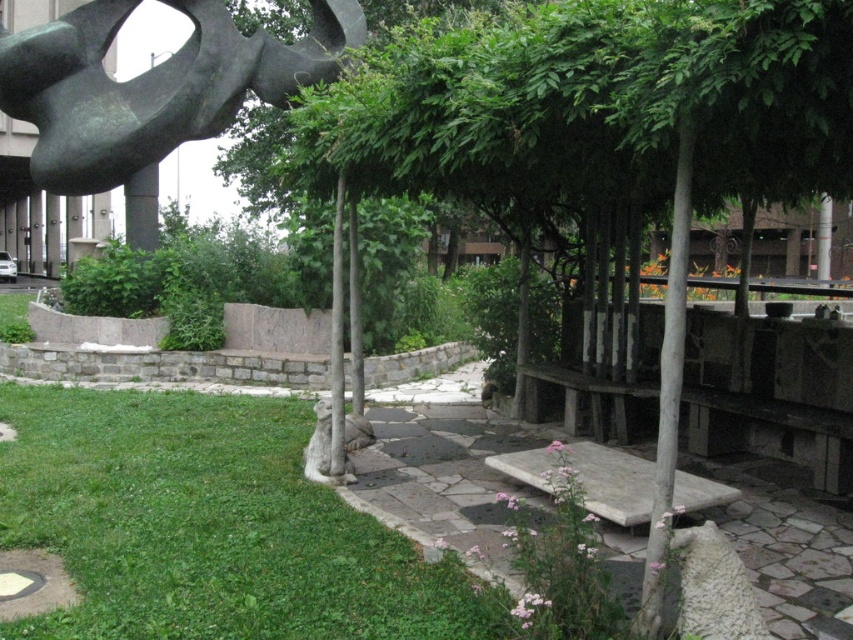
Who is shorter, bronze sculpture at upper left or smooth stone bench at center?

smooth stone bench at center is shorter.

Which of these two, bronze sculpture at upper left or smooth stone bench at center, stands taller?

Standing taller between the two is bronze sculpture at upper left.

Describe the element at coordinates (151, 84) in the screenshot. I see `bronze sculpture at upper left` at that location.

Locate an element on the screen. This screenshot has width=853, height=640. bronze sculpture at upper left is located at coordinates (151, 84).

Who is more forward, (x=15, y=456) or (x=677, y=496)?

Point (x=677, y=496) is in front.

Who is taller, green grass at lower left or smooth stone bench at center?

smooth stone bench at center is taller.

Measure the distance between point [16,420] and camera.

The distance of point [16,420] from camera is 25.41 feet.

At what (x,y) coordinates should I click in order to perform the action: click on green grass at lower left. Please return your answer as a coordinate pair (x, y). The image size is (853, 640). Looking at the image, I should click on (207, 525).

How distant is green grass at lower left from bronze sculpture at upper left?

A distance of 10.59 meters exists between green grass at lower left and bronze sculpture at upper left.

Does green grass at lower left appear on the left side of bronze sculpture at upper left?

No, green grass at lower left is not to the left of bronze sculpture at upper left.

Locate an element on the screen. The height and width of the screenshot is (640, 853). green grass at lower left is located at coordinates (207, 525).